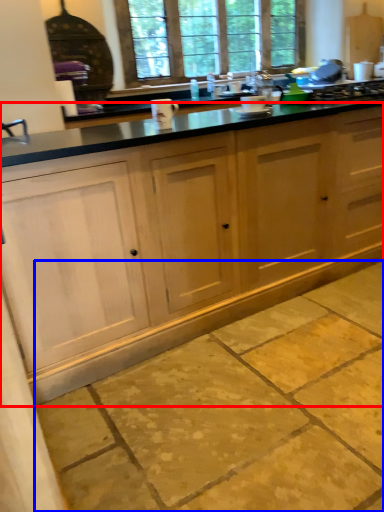
Question: Among these objects, which one is farthest to the camera, cabinetry (highlighted by a red box) or concrete (highlighted by a blue box)?

Choices:
 (A) cabinetry
 (B) concrete

Answer: (A)